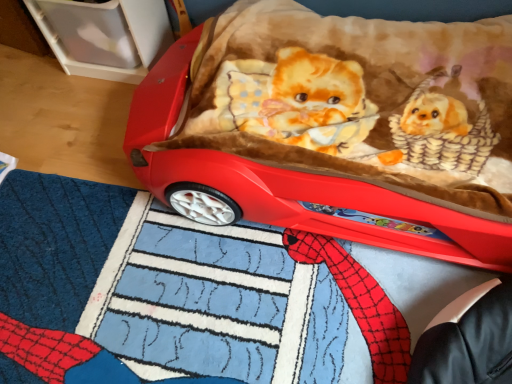
Question: Considering the relative sizes of matte plastic car at center and blue plush mat at lower center in the image provided, is matte plastic car at center bigger than blue plush mat at lower center?

Choices:
 (A) no
 (B) yes

Answer: (B)

Question: From a real-world perspective, is matte plastic car at center located beneath blue plush mat at lower center?

Choices:
 (A) yes
 (B) no

Answer: (B)

Question: Is blue plush mat at lower center completely or partially inside matte plastic car at center?

Choices:
 (A) yes
 (B) no

Answer: (B)

Question: Can you confirm if matte plastic car at center is taller than blue plush mat at lower center?

Choices:
 (A) yes
 (B) no

Answer: (A)

Question: Considering the relative sizes of matte plastic car at center and blue plush mat at lower center in the image provided, is matte plastic car at center wider than blue plush mat at lower center?

Choices:
 (A) no
 (B) yes

Answer: (A)

Question: Is matte plastic car at center at the left side of blue plush mat at lower center?

Choices:
 (A) no
 (B) yes

Answer: (A)

Question: Can you confirm if blue plush mat at lower center is shorter than matte plastic car at center?

Choices:
 (A) no
 (B) yes

Answer: (B)

Question: Are blue plush mat at lower center and matte plastic car at center located far from each other?

Choices:
 (A) no
 (B) yes

Answer: (A)

Question: Are blue plush mat at lower center and matte plastic car at center beside each other?

Choices:
 (A) yes
 (B) no

Answer: (B)

Question: Is blue plush mat at lower center smaller than matte plastic car at center?

Choices:
 (A) no
 (B) yes

Answer: (B)

Question: Is matte plastic car at center inside blue plush mat at lower center?

Choices:
 (A) no
 (B) yes

Answer: (A)

Question: Can you confirm if blue plush mat at lower center is thinner than matte plastic car at center?

Choices:
 (A) no
 (B) yes

Answer: (A)

Question: Looking at the image, does matte plastic car at center seem bigger or smaller compared to blue plush mat at lower center?

Choices:
 (A) small
 (B) big

Answer: (B)